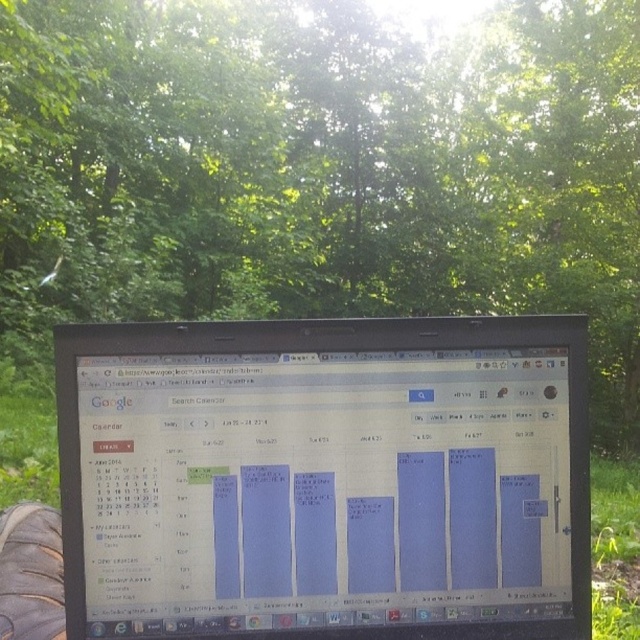
Between green leafy tree at center and matte plastic laptop at center, which one appears on the left side from the viewer's perspective?

matte plastic laptop at center is more to the left.

You are a GUI agent. You are given a task and a screenshot of the screen. Output one action in this format:
    pyautogui.click(x=<x>, y=<y>)
    Task: Click on the green leafy tree at center
    The width and height of the screenshot is (640, 640).
    Given the screenshot: What is the action you would take?
    pyautogui.click(x=323, y=168)